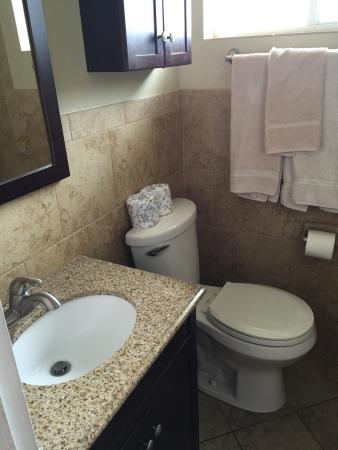
Where is `wall`? The height and width of the screenshot is (450, 338). wall is located at coordinates 72,93.